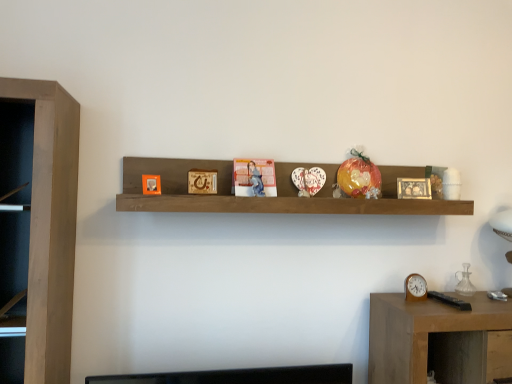
Identify the location of wooden shelf at center. This screenshot has height=384, width=512. (272, 197).

What do you see at coordinates (415, 288) in the screenshot? I see `wooden clock at right` at bounding box center [415, 288].

The width and height of the screenshot is (512, 384). Describe the element at coordinates (151, 184) in the screenshot. I see `orange matte picture frame at upper center, which ranks as the third picture frame in back-to-front order` at that location.

Measure the distance between point (x=415, y=184) and camera.

They are 1.78 meters apart.

This screenshot has height=384, width=512. Describe the element at coordinates (414, 188) in the screenshot. I see `wooden picture frame at center, the 3th picture frame in the left-to-right sequence` at that location.

Where is `wooden shelf at center`? This screenshot has height=384, width=512. wooden shelf at center is located at coordinates (272, 197).

From a real-world perspective, is wooden table at lower right physically below wooden picture frame at center, the 3th picture frame in the left-to-right sequence?

Yes, from a real-world perspective, wooden table at lower right is beneath wooden picture frame at center, the 3th picture frame in the left-to-right sequence.

Considering the relative sizes of wooden table at lower right and wooden picture frame at center, which appears as the 1th picture frame when viewed from the right, in the image provided, is wooden table at lower right bigger than wooden picture frame at center, which appears as the 1th picture frame when viewed from the right,?

Yes.

Is wooden table at lower right completely or partially outside of wooden picture frame at center, the 3th picture frame in the left-to-right sequence?

wooden table at lower right lies outside wooden picture frame at center, the 3th picture frame in the left-to-right sequence,'s area.

Does wooden table at lower right come in front of wooden picture frame at center, the third picture frame positioned from the front?

Yes.

Is translucent plastic toy at center not near matte plastic calendar at center?

That's not correct — translucent plastic toy at center is a little close to matte plastic calendar at center.

From the image's perspective, is translucent plastic toy at center on top of matte plastic calendar at center?

Yes.

Is translucent plastic toy at center facing away from matte plastic calendar at center?

No, matte plastic calendar at center is not at the back of translucent plastic toy at center.

Between woodenmaterial/texturepicture frame at center, which ranks as the 2th picture frame in left-to-right order, and wooden picture frame at center, the third picture frame positioned from the front, which one appears on the left side from the viewer's perspective?

From the viewer's perspective, woodenmaterial/texturepicture frame at center, which ranks as the 2th picture frame in left-to-right order, appears more on the left side.

Looking at this image, which point is more forward, (205,184) or (426,182)?

The point (205,184) is in front.

From the image's perspective, count 2nd picture frames upward from the wooden picture frame at center, which appears as the 1th picture frame when viewed from the right, and point to it. Please provide its 2D coordinates.

[(202, 181)]

What's the angular difference between woodenmaterial/texturepicture frame at center, which ranks as the 2th picture frame in left-to-right order, and wooden picture frame at center, which appears as the 1th picture frame when viewed from the right,'s facing directions?

woodenmaterial/texturepicture frame at center, which ranks as the 2th picture frame in left-to-right order, and wooden picture frame at center, which appears as the 1th picture frame when viewed from the right, are facing 26.7 degrees away from each other.

How different are the orientations of orange matte picture frame at upper center, placed as the 1th picture frame when sorted from left to right, and wooden shelf at center in degrees?

orange matte picture frame at upper center, placed as the 1th picture frame when sorted from left to right, and wooden shelf at center are facing 17.6 degrees away from each other.

Is point (144, 183) closer or farther from the camera than point (381, 172)?

Point (144, 183) appears to be closer to the viewer than point (381, 172).

Can you confirm if orange matte picture frame at upper center, which is the third picture frame in right-to-left order, is thinner than wooden shelf at center?

Indeed, orange matte picture frame at upper center, which is the third picture frame in right-to-left order, has a lesser width compared to wooden shelf at center.

You are a GUI agent. You are given a task and a screenshot of the screen. Output one action in this format:
    pyautogui.click(x=<x>, y=<y>)
    Task: Click on the toy located above the wooden shelf at center (from a real-world perspective)
    Image resolution: width=512 pixels, height=384 pixels.
    Given the screenshot: What is the action you would take?
    pyautogui.click(x=359, y=176)

Who is shorter, translucent plastic toy at center or wooden shelf at center?

translucent plastic toy at center is shorter.

Based on the photo, how many degrees apart are the facing directions of translucent plastic toy at center and wooden shelf at center?

There is a 5.17-degree angle between the facing directions of translucent plastic toy at center and wooden shelf at center.

Would you say translucent plastic toy at center is inside or outside wooden shelf at center?

The correct answer is: inside.

How different are the orientations of matte plastic calendar at center and wooden picture frame at center, marked as the first picture frame in a back-to-front arrangement, in degrees?

The angle between the facing direction of matte plastic calendar at center and the facing direction of wooden picture frame at center, marked as the first picture frame in a back-to-front arrangement, is 15.2 degrees.

From a real-world perspective, is matte plastic calendar at center over wooden picture frame at center, which appears as the 1th picture frame when viewed from the right?

Yes, from a real-world perspective, matte plastic calendar at center is above wooden picture frame at center, which appears as the 1th picture frame when viewed from the right.

Is matte plastic calendar at center looking in the opposite direction of wooden picture frame at center, which appears as the 1th picture frame when viewed from the right?

No, matte plastic calendar at center is not facing the opposite direction of wooden picture frame at center, which appears as the 1th picture frame when viewed from the right.

Considering the positions of point (252, 190) and point (428, 183), is point (252, 190) closer or farther from the camera than point (428, 183)?

Point (252, 190) is closer to the camera than point (428, 183).

From the image's perspective, between wooden picture frame at center, the third picture frame positioned from the front, and matte plastic calendar at center, which one is located above?

matte plastic calendar at center, from the image's perspective.

Based on their sizes in the image, would you say wooden picture frame at center, which appears as the 1th picture frame when viewed from the right, is bigger or smaller than matte plastic calendar at center?

In the image, wooden picture frame at center, which appears as the 1th picture frame when viewed from the right, appears to be smaller than matte plastic calendar at center.

Is wooden picture frame at center, marked as the first picture frame in a back-to-front arrangement, far from matte plastic calendar at center?

That's not correct — wooden picture frame at center, marked as the first picture frame in a back-to-front arrangement, is a little close to matte plastic calendar at center.

Where is `picture frame that is the 1st one when counting upward from the wooden table at lower right (from the image's perspective)`? picture frame that is the 1st one when counting upward from the wooden table at lower right (from the image's perspective) is located at coordinates (414, 188).

The image size is (512, 384). Identify the location of toy on the right of matte plastic calendar at center. (359, 176).

Looking at the image, which one is located closer to wooden shelf at center, matte plastic calendar at center or wooden clock at right?

matte plastic calendar at center lies closer to wooden shelf at center than the other object.

Looking at the image, which one is located closer to matte plastic calendar at center, wooden clock at right or wooden shelf at center?

wooden shelf at center lies closer to matte plastic calendar at center than the other object.

When comparing their distances from wooden shelf at center, does translucent plastic toy at center or wooden clock at right seem closer?

The object closer to wooden shelf at center is translucent plastic toy at center.

Which object lies nearer to the anchor point wooden shelf at center, woodenmaterial/texturepicture frame at center, the second picture frame in the back-to-front sequence, or wooden table at lower right?

woodenmaterial/texturepicture frame at center, the second picture frame in the back-to-front sequence.

Which object lies further to the anchor point wooden table at lower right, orange matte picture frame at upper center, placed as the 1th picture frame when sorted from left to right, or wooden clock at right?

orange matte picture frame at upper center, placed as the 1th picture frame when sorted from left to right, lies further to wooden table at lower right than the other object.

Considering their positions, is orange matte picture frame at upper center, placed as the 1th picture frame when sorted from left to right, positioned further to wooden shelf at center than woodenmaterial/texturepicture frame at center, which ranks as the 2th picture frame in left-to-right order?

The object further to wooden shelf at center is orange matte picture frame at upper center, placed as the 1th picture frame when sorted from left to right.

From the image, which object appears to be farther from wooden clock at right, matte plastic calendar at center or woodenmaterial/texturepicture frame at center, the second picture frame in the back-to-front sequence?

woodenmaterial/texturepicture frame at center, the second picture frame in the back-to-front sequence.

Consider the image. Based on their spatial positions, is wooden table at lower right or translucent plastic toy at center further from wooden picture frame at center, which appears as the 1th picture frame when viewed from the right?

wooden table at lower right lies further to wooden picture frame at center, which appears as the 1th picture frame when viewed from the right, than the other object.

This screenshot has width=512, height=384. I want to click on toy between woodenmaterial/texturepicture frame at center, which ranks as the 2th picture frame in left-to-right order, and wooden table at lower right from left to right, so click(359, 176).

Locate an element on the screen. This screenshot has height=384, width=512. toy between wooden shelf at center and wooden picture frame at center, the third picture frame positioned from the front is located at coordinates (359, 176).

At what (x,y) coordinates should I click in order to perform the action: click on shelf located between matte plastic calendar at center and wooden clock at right in the left-right direction. Please return your answer as a coordinate pair (x, y). The height and width of the screenshot is (384, 512). Looking at the image, I should click on (272, 197).

Image resolution: width=512 pixels, height=384 pixels. I want to click on picture frame situated between orange matte picture frame at upper center, which is the third picture frame in right-to-left order, and matte plastic calendar at center from left to right, so click(202, 181).